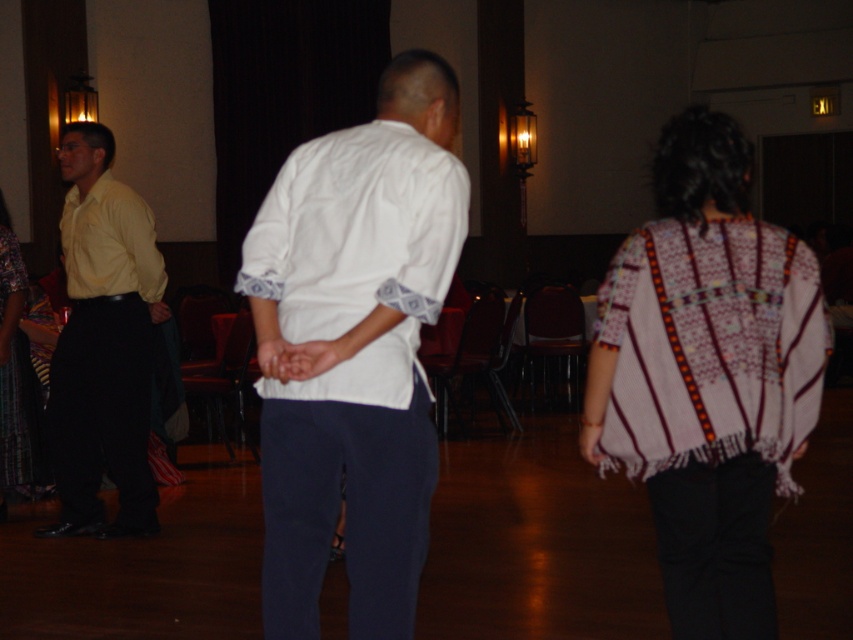
Is white cotton shirt at center thinner than matte yellow shirt at left?

In fact, white cotton shirt at center might be wider than matte yellow shirt at left.

Does white cotton shirt at center have a larger size compared to matte yellow shirt at left?

Correct, white cotton shirt at center is larger in size than matte yellow shirt at left.

Locate an element on the screen. This screenshot has height=640, width=853. white cotton shirt at center is located at coordinates (354, 348).

Does white cotton shirt at center appear under yellow matte shirt at left?

No.

Is white cotton shirt at center above yellow matte shirt at left?

Yes.

Which is in front, point (457, 252) or point (106, 429)?

Point (457, 252)

Where is `white cotton shirt at center`? Image resolution: width=853 pixels, height=640 pixels. white cotton shirt at center is located at coordinates (354, 348).

Is yellow matte shirt at left further to camera compared to patterned fabric poncho at center?

That is False.

Does yellow matte shirt at left appear under patterned fabric poncho at center?

Incorrect, yellow matte shirt at left is not positioned below patterned fabric poncho at center.

Is point (125, 268) behind point (7, 212)?

That is False.

Where is `yellow matte shirt at left`? yellow matte shirt at left is located at coordinates (103, 342).